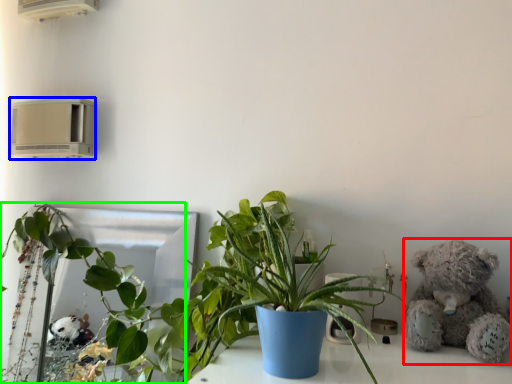
Question: Considering the real-world distances, which object is farthest from teddy bear (highlighted by a red box)? air conditioning (highlighted by a blue box) or houseplant (highlighted by a green box)?

Choices:
 (A) air conditioning
 (B) houseplant

Answer: (A)